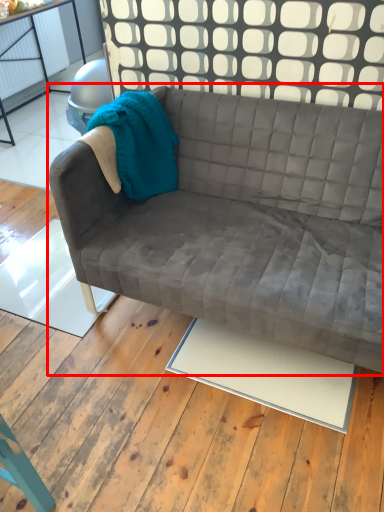
Question: From the image's perspective, where is studio couch (annotated by the red box) located in relation to plywood in the image?

Choices:
 (A) below
 (B) above

Answer: (B)